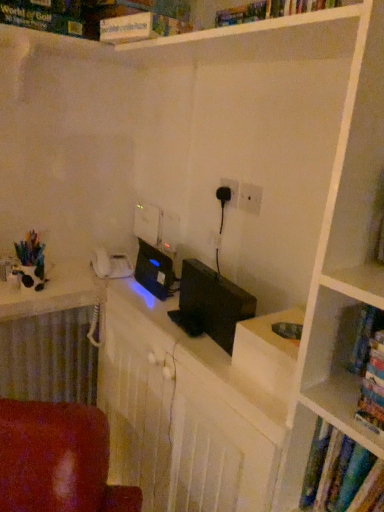
Where is `free space in front of black matte computer monitor at center`? The height and width of the screenshot is (512, 384). free space in front of black matte computer monitor at center is located at coordinates (205, 361).